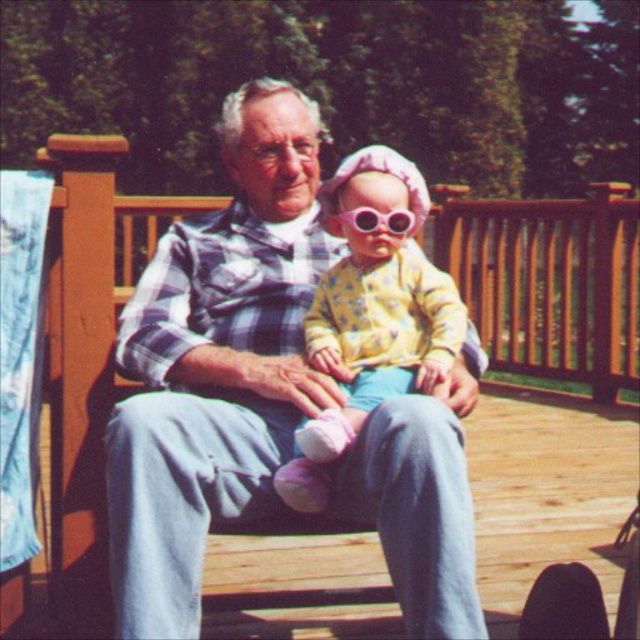
Question: Which of the following is the closest to the observer?

Choices:
 (A) (403, 214)
 (B) (460, 340)

Answer: (A)

Question: Is matte plaid shirt at center bigger than pink plastic goggles at center?

Choices:
 (A) no
 (B) yes

Answer: (B)

Question: Can you confirm if matte plaid shirt at center is positioned above yellow fabric baby at center?

Choices:
 (A) no
 (B) yes

Answer: (B)

Question: Which is nearer to the yellow fabric baby at center?

Choices:
 (A) matte plaid shirt at center
 (B) pink plastic goggles at center

Answer: (B)

Question: Is matte plaid shirt at center wider than pink plastic goggles at center?

Choices:
 (A) yes
 (B) no

Answer: (A)

Question: Which point is closer to the camera?

Choices:
 (A) (368, 225)
 (B) (291, 497)

Answer: (B)